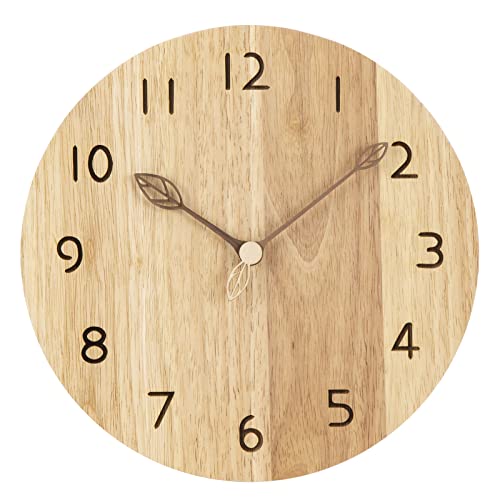
At what (x,y) coordinates should I click in order to perform the action: click on the darkest wood section. Please return your answer as a coordinate pair (x, y). The image size is (500, 500). Looking at the image, I should click on (330, 274).